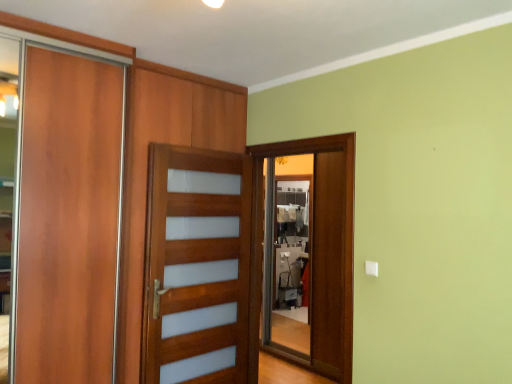
This screenshot has width=512, height=384. Identify the location of wooden screen door at center, the second screen door positioned from the left. (304, 253).

Describe the element at coordinates (304, 253) in the screenshot. I see `wooden screen door at center, which is counted as the 1th screen door, starting from the right` at that location.

Locate an element on the screen. translucent wood screen door at center, the first screen door positioned from the left is located at coordinates (196, 267).

The width and height of the screenshot is (512, 384). Describe the element at coordinates (196, 267) in the screenshot. I see `translucent wood screen door at center, the 2th screen door in the right-to-left sequence` at that location.

Identify the location of wooden screen door at center, which is counted as the 1th screen door, starting from the right. (304, 253).

From the picture: Is translucent wood screen door at center, the 2th screen door in the right-to-left sequence, to the right of wooden screen door at center, which is counted as the 1th screen door, starting from the right, from the viewer's perspective?

Incorrect, translucent wood screen door at center, the 2th screen door in the right-to-left sequence, is not on the right side of wooden screen door at center, which is counted as the 1th screen door, starting from the right.

Is translucent wood screen door at center, the first screen door positioned from the left, closer to the viewer compared to wooden screen door at center, the second screen door positioned from the left?

Yes, translucent wood screen door at center, the first screen door positioned from the left, is closer to the viewer.

Is point (189, 288) farther from viewer compared to point (333, 341)?

That is False.

From the image's perspective, relative to wooden screen door at center, which is counted as the 1th screen door, starting from the right, is translucent wood screen door at center, the 2th screen door in the right-to-left sequence, above or below?

From the image's perspective, translucent wood screen door at center, the 2th screen door in the right-to-left sequence, appears below wooden screen door at center, which is counted as the 1th screen door, starting from the right.

From a real-world perspective, is translucent wood screen door at center, the first screen door positioned from the left, under wooden screen door at center, which is counted as the 1th screen door, starting from the right?

Correct, in the physical world, translucent wood screen door at center, the first screen door positioned from the left, is lower than wooden screen door at center, which is counted as the 1th screen door, starting from the right.

In terms of width, does translucent wood screen door at center, the first screen door positioned from the left, look wider or thinner when compared to wooden screen door at center, the second screen door positioned from the left?

In the image, translucent wood screen door at center, the first screen door positioned from the left, appears to be wider than wooden screen door at center, the second screen door positioned from the left.

Between translucent wood screen door at center, the 2th screen door in the right-to-left sequence, and wooden screen door at center, the second screen door positioned from the left, which one has less height?

Standing shorter between the two is translucent wood screen door at center, the 2th screen door in the right-to-left sequence.

Which of these two, translucent wood screen door at center, the first screen door positioned from the left, or wooden screen door at center, which is counted as the 1th screen door, starting from the right, is bigger?

Bigger between the two is translucent wood screen door at center, the first screen door positioned from the left.

Is wooden screen door at center, the second screen door positioned from the left, located within translucent wood screen door at center, the first screen door positioned from the left?

That's incorrect, wooden screen door at center, the second screen door positioned from the left, is not inside translucent wood screen door at center, the first screen door positioned from the left.

Would you consider translucent wood screen door at center, the 2th screen door in the right-to-left sequence, to be distant from wooden screen door at center, which is counted as the 1th screen door, starting from the right?

Yes, translucent wood screen door at center, the 2th screen door in the right-to-left sequence, and wooden screen door at center, which is counted as the 1th screen door, starting from the right, are located far from each other.

Is translucent wood screen door at center, the 2th screen door in the right-to-left sequence, aimed at wooden screen door at center, the second screen door positioned from the left?

Yes, translucent wood screen door at center, the 2th screen door in the right-to-left sequence, is turned towards wooden screen door at center, the second screen door positioned from the left.

How far apart are translucent wood screen door at center, the first screen door positioned from the left, and wooden screen door at center, which is counted as the 1th screen door, starting from the right?

translucent wood screen door at center, the first screen door positioned from the left, and wooden screen door at center, which is counted as the 1th screen door, starting from the right, are 5.03 feet apart from each other.

The width and height of the screenshot is (512, 384). Identify the location of screen door beneath the wooden screen door at center, which is counted as the 1th screen door, starting from the right (from a real-world perspective). (196, 267).

Based on the photo, is wooden screen door at center, the second screen door positioned from the left, at the right side of translucent wood screen door at center, the 2th screen door in the right-to-left sequence?

Indeed, wooden screen door at center, the second screen door positioned from the left, is positioned on the right side of translucent wood screen door at center, the 2th screen door in the right-to-left sequence.

Is wooden screen door at center, the second screen door positioned from the left, positioned behind translucent wood screen door at center, the first screen door positioned from the left?

That is True.

Does point (337, 154) appear closer or farther from the camera than point (191, 338)?

Clearly, point (337, 154) is more distant from the camera than point (191, 338).

From the image's perspective, relative to translucent wood screen door at center, the first screen door positioned from the left, is wooden screen door at center, the second screen door positioned from the left, above or below?

From the image's perspective, wooden screen door at center, the second screen door positioned from the left, appears above translucent wood screen door at center, the first screen door positioned from the left.

From a real-world perspective, relative to translucent wood screen door at center, the first screen door positioned from the left, is wooden screen door at center, which is counted as the 1th screen door, starting from the right, vertically above or below?

wooden screen door at center, which is counted as the 1th screen door, starting from the right, is situated higher than translucent wood screen door at center, the first screen door positioned from the left, in the real world.

Between wooden screen door at center, the second screen door positioned from the left, and translucent wood screen door at center, the 2th screen door in the right-to-left sequence, which one has smaller width?

With smaller width is wooden screen door at center, the second screen door positioned from the left.

Who is taller, wooden screen door at center, the second screen door positioned from the left, or translucent wood screen door at center, the first screen door positioned from the left?

wooden screen door at center, the second screen door positioned from the left, is taller.

Considering the relative sizes of wooden screen door at center, the second screen door positioned from the left, and translucent wood screen door at center, the 2th screen door in the right-to-left sequence, in the image provided, is wooden screen door at center, the second screen door positioned from the left, bigger than translucent wood screen door at center, the 2th screen door in the right-to-left sequence,?

No.

Do you think wooden screen door at center, the second screen door positioned from the left, is within translucent wood screen door at center, the first screen door positioned from the left, or outside of it?

wooden screen door at center, the second screen door positioned from the left, exists outside the volume of translucent wood screen door at center, the first screen door positioned from the left.

In the scene shown: Would you consider wooden screen door at center, which is counted as the 1th screen door, starting from the right, to be distant from translucent wood screen door at center, the first screen door positioned from the left?

Yes, wooden screen door at center, which is counted as the 1th screen door, starting from the right, is far from translucent wood screen door at center, the first screen door positioned from the left.

Is wooden screen door at center, which is counted as the 1th screen door, starting from the right, looking in the opposite direction of translucent wood screen door at center, the first screen door positioned from the left?

No.

Find the location of a particular element. This screenshot has height=384, width=512. screen door that appears above the translucent wood screen door at center, the 2th screen door in the right-to-left sequence (from the image's perspective) is located at coordinates (x=304, y=253).

Where is `screen door that is on the left side of wooden screen door at center, the second screen door positioned from the left`? The height and width of the screenshot is (384, 512). screen door that is on the left side of wooden screen door at center, the second screen door positioned from the left is located at coordinates (196, 267).

At what (x,y) coordinates should I click in order to perform the action: click on screen door that appears behind the translucent wood screen door at center, the first screen door positioned from the left. Please return your answer as a coordinate pair (x, y). The width and height of the screenshot is (512, 384). Looking at the image, I should click on (304, 253).